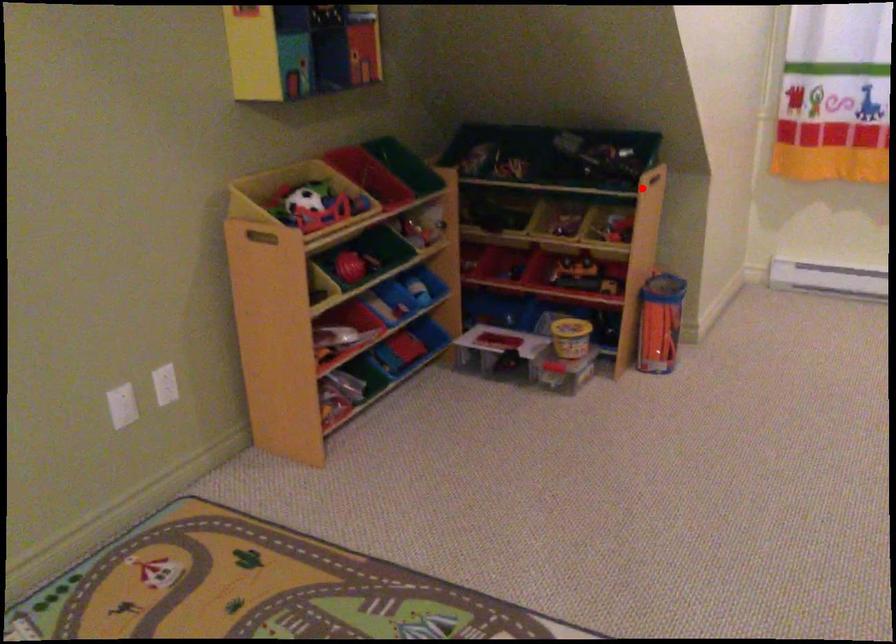
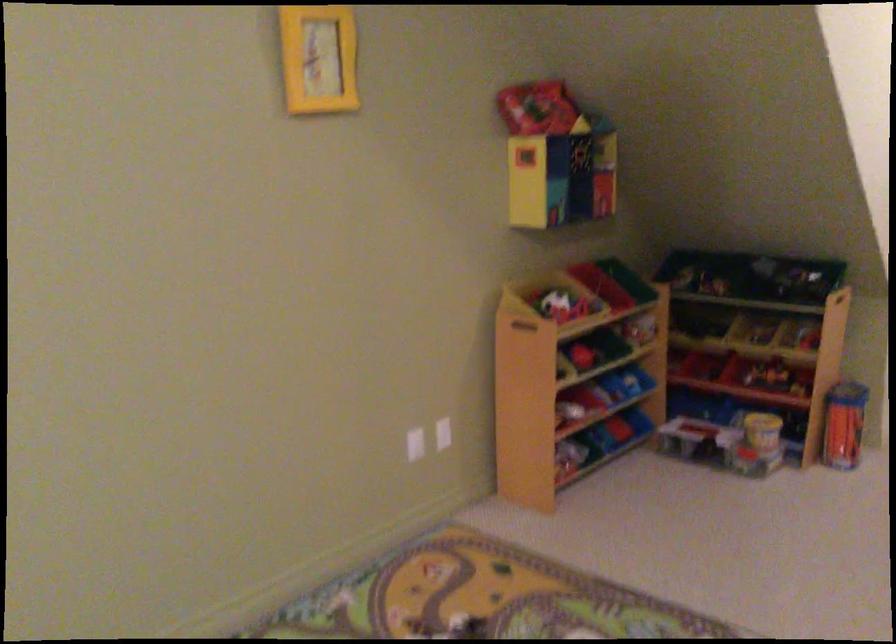
Question: I am providing you with two images of the same scene from different viewpoints. A red point is marked on the first image. Is the red point's position out of view in image 2?

Choices:
 (A) Yes
 (B) No

Answer: (B)